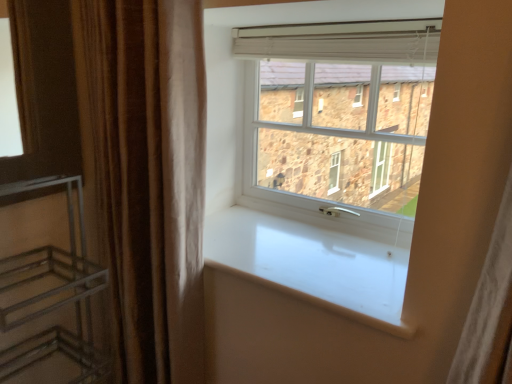
Question: Would you say brown velvet curtain at left is a long distance from white glossy window sill at center?

Choices:
 (A) no
 (B) yes

Answer: (A)

Question: Could you tell me if brown velvet curtain at left is facing white glossy window sill at center?

Choices:
 (A) no
 (B) yes

Answer: (A)

Question: From a real-world perspective, is brown velvet curtain at left positioned over white glossy window sill at center based on gravity?

Choices:
 (A) yes
 (B) no

Answer: (A)

Question: Considering the relative sizes of brown velvet curtain at left and white glossy window sill at center in the image provided, is brown velvet curtain at left thinner than white glossy window sill at center?

Choices:
 (A) yes
 (B) no

Answer: (A)

Question: Are brown velvet curtain at left and white glossy window sill at center making contact?

Choices:
 (A) yes
 (B) no

Answer: (B)

Question: Looking at their shapes, would you say white plastic window at center is wider or thinner than brown velvet curtain at left?

Choices:
 (A) wide
 (B) thin

Answer: (B)

Question: Is white plastic window at center inside the boundaries of brown velvet curtain at left, or outside?

Choices:
 (A) outside
 (B) inside

Answer: (A)

Question: From a real-world perspective, relative to brown velvet curtain at left, is white plastic window at center vertically above or below?

Choices:
 (A) below
 (B) above

Answer: (B)

Question: Is point (395, 162) closer or farther from the camera than point (159, 377)?

Choices:
 (A) closer
 (B) farther

Answer: (B)

Question: In terms of height, does white glossy window sill at center look taller or shorter compared to brown velvet curtain at left?

Choices:
 (A) short
 (B) tall

Answer: (A)

Question: From the image's perspective, is white glossy window sill at center above or below brown velvet curtain at left?

Choices:
 (A) above
 (B) below

Answer: (B)

Question: Is white glossy window sill at center inside or outside of brown velvet curtain at left?

Choices:
 (A) outside
 (B) inside

Answer: (A)

Question: In terms of width, does white glossy window sill at center look wider or thinner when compared to brown velvet curtain at left?

Choices:
 (A) thin
 (B) wide

Answer: (B)

Question: From the image's perspective, is metallic silver shelf at left positioned above or below brown velvet curtain at left?

Choices:
 (A) below
 (B) above

Answer: (A)

Question: Relative to brown velvet curtain at left, is metallic silver shelf at left in front or behind?

Choices:
 (A) behind
 (B) front

Answer: (B)